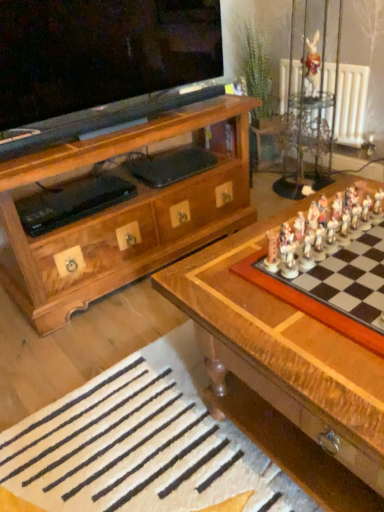
Locate an element on the screen. The image size is (384, 512). free space to the back side of clear glass vase at upper right is located at coordinates (284, 167).